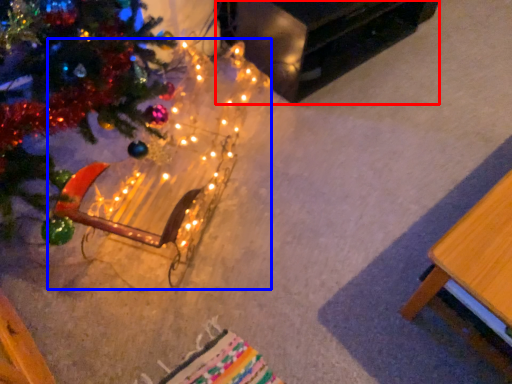
Question: Which object is closer to the camera taking this photo, table (highlighted by a red box) or christmas decoration (highlighted by a blue box)?

Choices:
 (A) table
 (B) christmas decoration

Answer: (B)